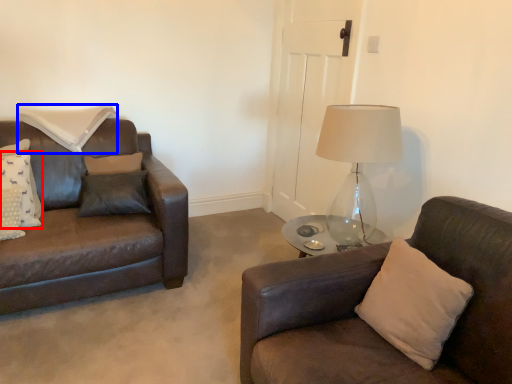
Question: Which of the following is the closest to the observer, pillow (highlighted by a red box) or pillow (highlighted by a blue box)?

Choices:
 (A) pillow
 (B) pillow

Answer: (A)